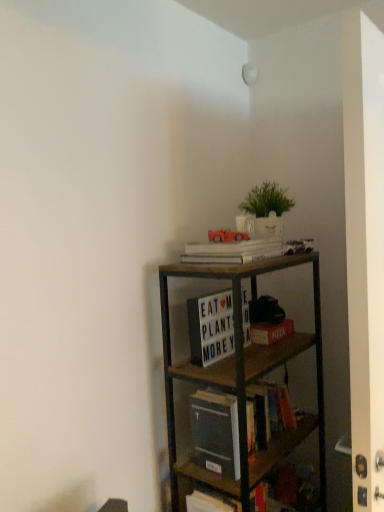
The image size is (384, 512). What are the coordinates of `red matte paper at center` in the screenshot? It's located at (270, 332).

What do you see at coordinates (270, 332) in the screenshot? I see `red matte paper at center` at bounding box center [270, 332].

This screenshot has height=512, width=384. Describe the element at coordinates (243, 378) in the screenshot. I see `wooden shelf at center` at that location.

At what (x,y) coordinates should I click in order to perform the action: click on green matte plant at upper center. Please return your answer as a coordinate pair (x, y). This screenshot has height=512, width=384. Looking at the image, I should click on (264, 210).

This screenshot has width=384, height=512. What do you see at coordinates (264, 210) in the screenshot? I see `green matte plant at upper center` at bounding box center [264, 210].

Find the location of a particular element. Image resolution: width=384 pixels, height=512 pixels. hardcover book at center, acting as the first book starting from the bottom is located at coordinates (216, 432).

From a real-world perspective, which is physically above, white matte letter board at center, which appears as the 2th book when ordered from the bottom, or green matte plant at upper center?

green matte plant at upper center.

Is white matte letter board at center, positioned as the second book in top-to-bottom order, positioned far away from green matte plant at upper center?

No, white matte letter board at center, positioned as the second book in top-to-bottom order, is in close proximity to green matte plant at upper center.

In the scene shown: Is white matte letter board at center, which appears as the 2th book when ordered from the bottom, facing towards green matte plant at upper center?

No, white matte letter board at center, which appears as the 2th book when ordered from the bottom, is not turned towards green matte plant at upper center.

Could you measure the distance between matte red car at upper center and white matte book at upper center, acting as the 3th book starting from the bottom?

matte red car at upper center is 2.86 inches away from white matte book at upper center, acting as the 3th book starting from the bottom.

The width and height of the screenshot is (384, 512). Identify the location of the 1st book located beneath the matte red car at upper center (from a real-world perspective). (233, 251).

Based on the photo, how different are the orientations of matte red car at upper center and white matte book at upper center, marked as the 1th book in a top-to-bottom arrangement, in degrees?

0.00102 degrees.

From a real-world perspective, between matte red car at upper center and white matte book at upper center, marked as the 1th book in a top-to-bottom arrangement, who is vertically lower?

In real-world perspective, white matte book at upper center, marked as the 1th book in a top-to-bottom arrangement, is lower.

In the scene shown: How different are the orientations of red matte paper at center and white matte book at upper center, acting as the 3th book starting from the bottom, in degrees?

The facing directions of red matte paper at center and white matte book at upper center, acting as the 3th book starting from the bottom, are 4.83 degrees apart.

From the image's perspective, which book is the 2nd one above the red matte paper at center? Please provide its 2D coordinates.

[(233, 251)]

Is red matte paper at center looking in the opposite direction of white matte book at upper center, marked as the 1th book in a top-to-bottom arrangement?

No, red matte paper at center's orientation is not away from white matte book at upper center, marked as the 1th book in a top-to-bottom arrangement.

Which is in front, point (252, 338) or point (236, 261)?

The point (236, 261) is closer to the camera.

Is matte red car at upper center located outside red matte paper at center?

Yes, matte red car at upper center is outside of red matte paper at center.

Considering the sizes of objects matte red car at upper center and red matte paper at center in the image provided, who is bigger, matte red car at upper center or red matte paper at center?

red matte paper at center is bigger.

Are matte red car at upper center and red matte paper at center far apart?

No, there isn't a large distance between matte red car at upper center and red matte paper at center.

Is matte red car at upper center in front of or behind red matte paper at center in the image?

matte red car at upper center is in front of red matte paper at center.

Considering the points (256, 244) and (218, 423), which point is behind, point (256, 244) or point (218, 423)?

The point (256, 244) is farther.

Who is taller, white matte book at upper center, marked as the 1th book in a top-to-bottom arrangement, or hardcover book at center, acting as the first book starting from the bottom?

Standing taller between the two is hardcover book at center, acting as the first book starting from the bottom.

Between white matte book at upper center, marked as the 1th book in a top-to-bottom arrangement, and hardcover book at center, acting as the first book starting from the bottom, which one has larger size?

Bigger between the two is hardcover book at center, acting as the first book starting from the bottom.

Based on the photo, from the image's perspective, between white matte book at upper center, acting as the 3th book starting from the bottom, and hardcover book at center, placed as the 3th book when sorted from top to bottom, which one is located above?

white matte book at upper center, acting as the 3th book starting from the bottom.

Is the position of red matte paper at center less distant than that of green matte plant at upper center?

That is False.

In the scene shown: In terms of height, does red matte paper at center look taller or shorter compared to green matte plant at upper center?

red matte paper at center is shorter than green matte plant at upper center.

Does wooden shelf at center have a larger size compared to red matte paper at center?

Indeed, wooden shelf at center has a larger size compared to red matte paper at center.

Considering the positions of points (267, 468) and (271, 339), is point (267, 468) farther from camera compared to point (271, 339)?

No, it is in front of (271, 339).

Is red matte paper at center inside wooden shelf at center?

Yes.

Image resolution: width=384 pixels, height=512 pixels. I want to click on shelf below the red matte paper at center (from a real-world perspective), so click(243, 378).

From a real-world perspective, count 2nd books downward from the green matte plant at upper center and point to it. Please provide its 2D coordinates.

[(211, 327)]

From the matte red car at upper center, count 1st books forward and point to it. Please provide its 2D coordinates.

[(233, 251)]

When comparing their distances from hardcover book at center, placed as the 3th book when sorted from top to bottom, does white matte book at upper center, marked as the 1th book in a top-to-bottom arrangement, or green matte plant at upper center seem closer?

The object closer to hardcover book at center, placed as the 3th book when sorted from top to bottom, is white matte book at upper center, marked as the 1th book in a top-to-bottom arrangement.

Which object lies further to the anchor point hardcover book at center, placed as the 3th book when sorted from top to bottom, white matte book at upper center, acting as the 3th book starting from the bottom, or matte red car at upper center?

Based on the image, matte red car at upper center appears to be further to hardcover book at center, placed as the 3th book when sorted from top to bottom.

Considering their positions, is hardcover book at center, acting as the first book starting from the bottom, positioned closer to white matte letter board at center, positioned as the second book in top-to-bottom order, than green matte plant at upper center?

Among the two, hardcover book at center, acting as the first book starting from the bottom, is located nearer to white matte letter board at center, positioned as the second book in top-to-bottom order.

From the image, which object appears to be farther from white matte letter board at center, positioned as the second book in top-to-bottom order, white matte book at upper center, marked as the 1th book in a top-to-bottom arrangement, or matte red car at upper center?

Based on the image, matte red car at upper center appears to be further to white matte letter board at center, positioned as the second book in top-to-bottom order.

Based on the photo, considering their positions, is white matte book at upper center, acting as the 3th book starting from the bottom, positioned closer to red matte paper at center than hardcover book at center, placed as the 3th book when sorted from top to bottom?

hardcover book at center, placed as the 3th book when sorted from top to bottom, is closer to red matte paper at center.

Estimate the real-world distances between objects in this image. Which object is closer to green matte plant at upper center, hardcover book at center, placed as the 3th book when sorted from top to bottom, or white matte book at upper center, acting as the 3th book starting from the bottom?

white matte book at upper center, acting as the 3th book starting from the bottom.

Considering their positions, is white matte book at upper center, acting as the 3th book starting from the bottom, positioned closer to wooden shelf at center than white matte letter board at center, which appears as the 2th book when ordered from the bottom?

Among the two, white matte letter board at center, which appears as the 2th book when ordered from the bottom, is located nearer to wooden shelf at center.

Which object lies nearer to the anchor point wooden shelf at center, matte red car at upper center or hardcover book at center, acting as the first book starting from the bottom?

hardcover book at center, acting as the first book starting from the bottom, is positioned closer to the anchor wooden shelf at center.

What are the coordinates of `paperback book between green matte plant at upper center and hardcover book at center, acting as the first book starting from the bottom, vertically` in the screenshot? It's located at (270, 332).

I want to click on paperback book between matte red car at upper center and hardcover book at center, acting as the first book starting from the bottom, vertically, so click(x=270, y=332).

You are a GUI agent. You are given a task and a screenshot of the screen. Output one action in this format:
    pyautogui.click(x=<x>, y=<y>)
    Task: Click on the book between white matte book at upper center, acting as the 3th book starting from the bottom, and red matte paper at center, in the vertical direction
    
    Given the screenshot: What is the action you would take?
    pyautogui.click(x=211, y=327)

Find the location of `toy between green matte plant at upper center and white matte letter board at center, which appears as the 2th book when ordered from the bottom, in the up-down direction`. toy between green matte plant at upper center and white matte letter board at center, which appears as the 2th book when ordered from the bottom, in the up-down direction is located at coordinates (227, 236).